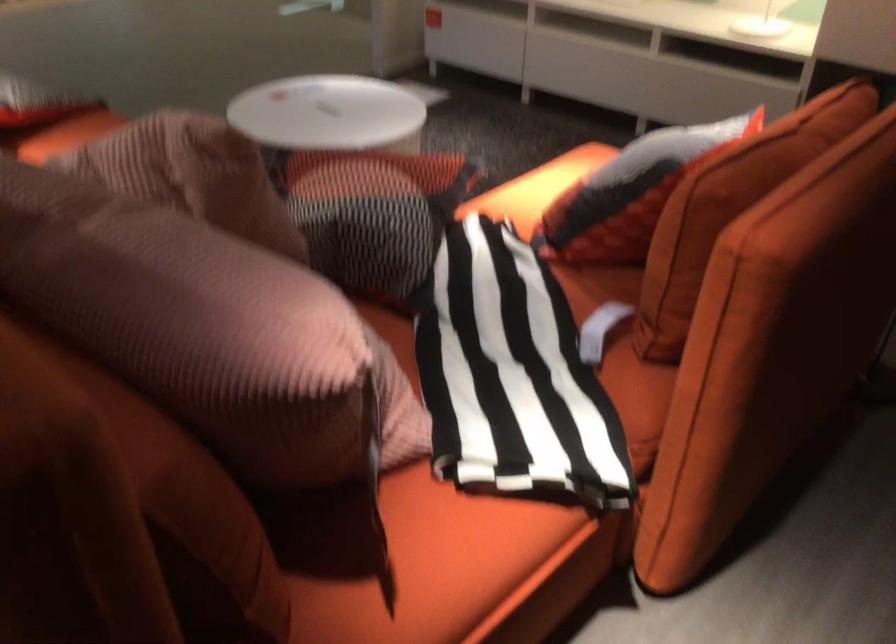
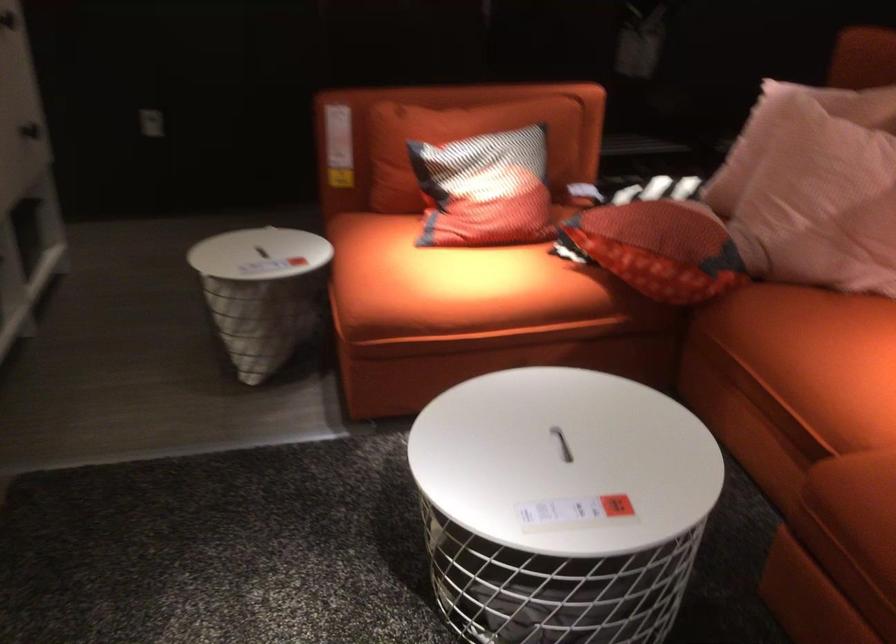
In the second image, find the point that corresponds to (615,158) in the first image.

(485, 190)